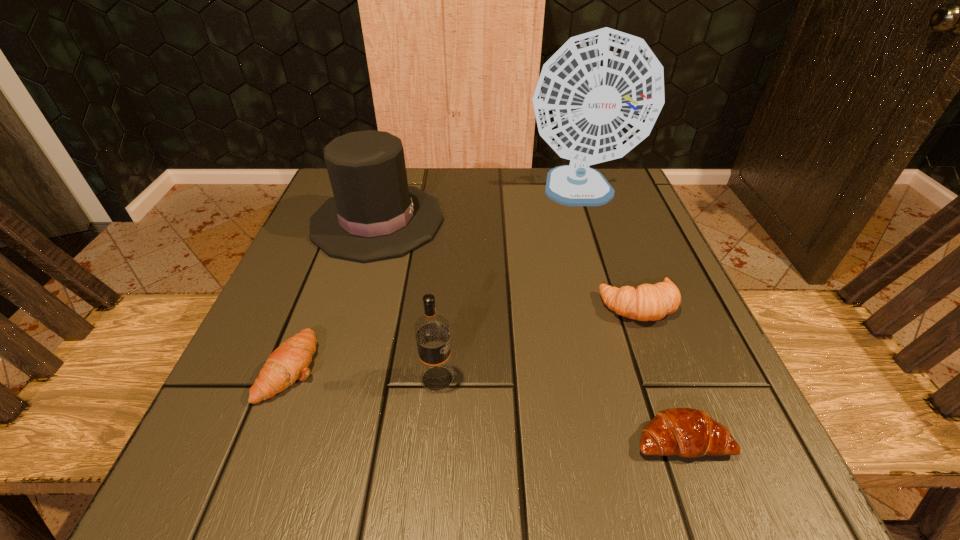
Identify the location of empty space that is in between the vodka and the nearest crescent roll. (560, 409).

Where is `free space between the tallest crescent roll and the dress hat`? Image resolution: width=960 pixels, height=540 pixels. free space between the tallest crescent roll and the dress hat is located at coordinates (508, 263).

I want to click on vacant point located between the tallest object and the dress hat, so click(x=478, y=207).

Where is `unoccupied area between the dress hat and the vodka`? Image resolution: width=960 pixels, height=540 pixels. unoccupied area between the dress hat and the vodka is located at coordinates (x=407, y=300).

Locate an element on the screen. free spot between the third shortest object and the vodka is located at coordinates (539, 342).

Identify the location of unoccupied area between the second farthest crescent roll and the dress hat. (334, 294).

You are a GUI agent. You are given a task and a screenshot of the screen. Output one action in this format:
    pyautogui.click(x=<x>, y=<y>)
    Task: Click on the free space that is in between the vodka and the nearest object
    
    Given the screenshot: What is the action you would take?
    pyautogui.click(x=560, y=409)

This screenshot has width=960, height=540. Find the location of `object that can be found as the closest to the dress hat`. object that can be found as the closest to the dress hat is located at coordinates (289, 362).

I want to click on the closest object to the dress hat, so click(x=289, y=362).

Identify which crescent roll is located as the second nearest to the third shortest object. Please provide its 2D coordinates. Your answer should be formatted as a tuple, i.e. [(x, y)], where the tuple contains the x and y coordinates of a point satisfying the conditions above.

[(289, 362)]